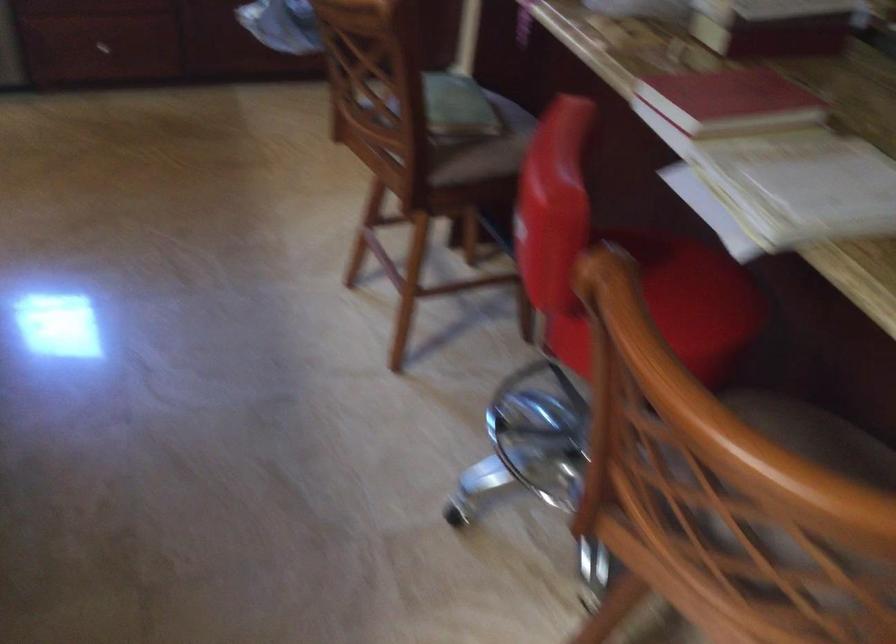
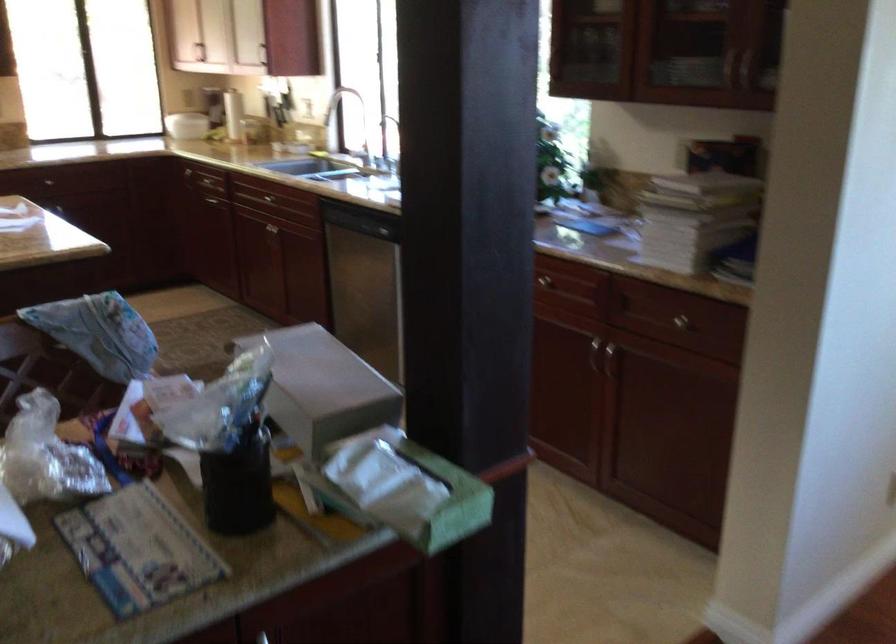
Question: I am providing you with two images of the same scene from different viewpoints. Please identify which objects are invisible in image2.

Choices:
 (A) dark glass bottle
 (B) red plastic tub
 (C) metal cabinet handle
 (D) green book

Answer: (D)